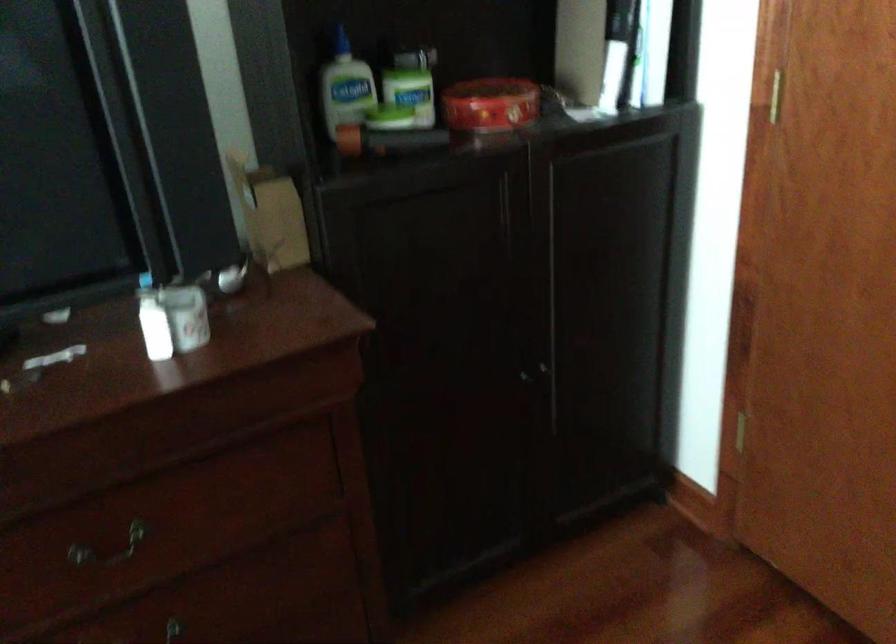
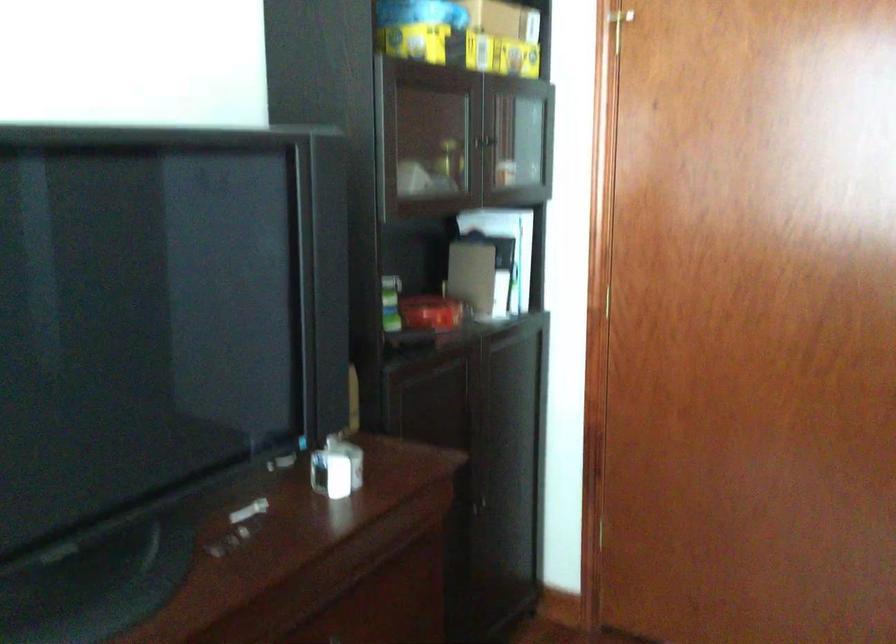
Where in the second image is the point corresponding to (481,106) from the first image?

(431, 313)